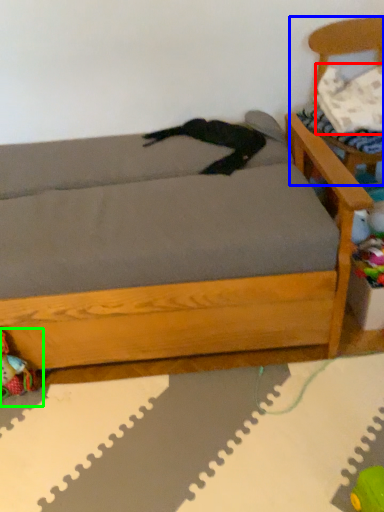
Question: Estimate the real-world distances between objects in this image. Which object is closer to pillow (highlighted by a red box), armchair (highlighted by a blue box) or toy (highlighted by a green box)?

Choices:
 (A) armchair
 (B) toy

Answer: (A)